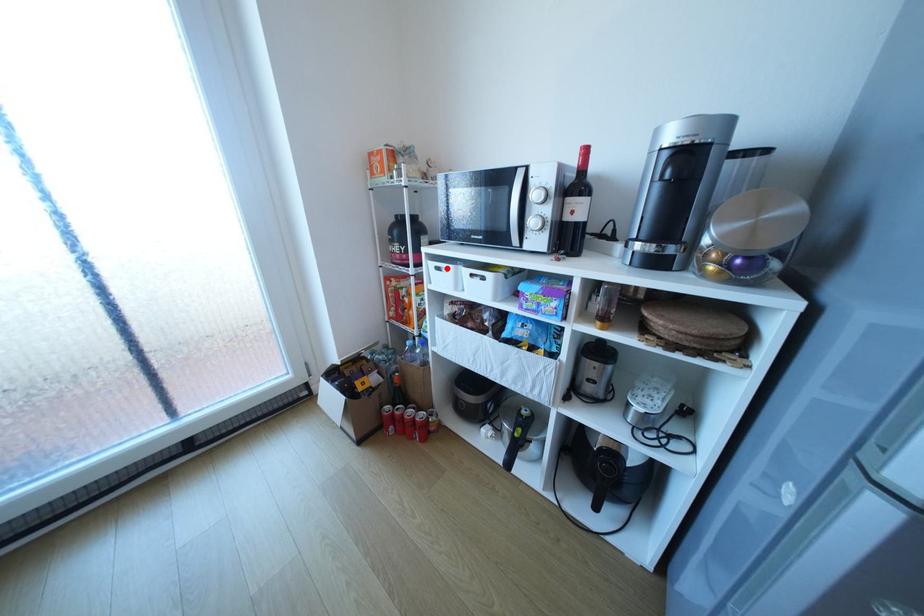
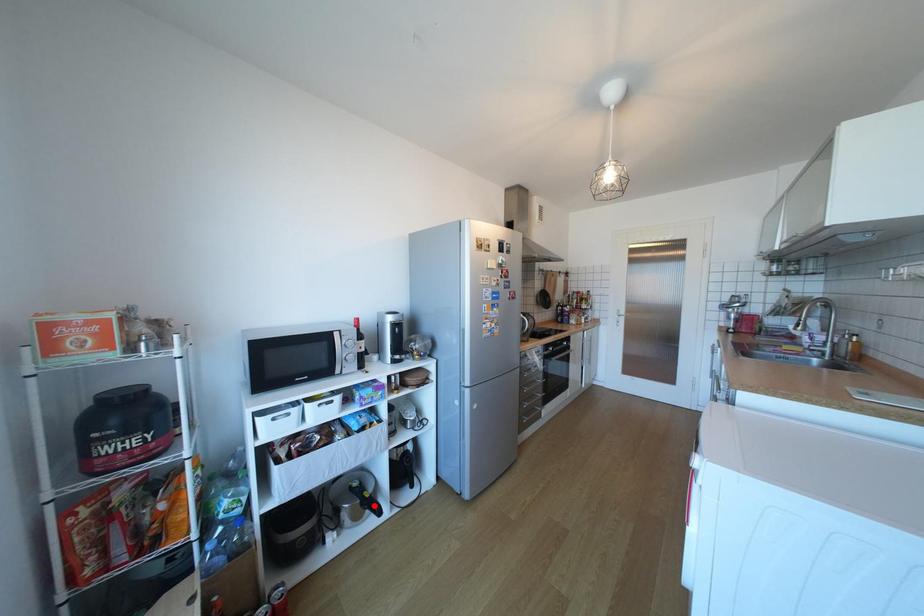
I am providing you with two images of the same scene from different viewpoints. A red point is marked on the first image and another point is marked on the second image. Does the point marked in image1 correspond to the same location as the one in image2?

No